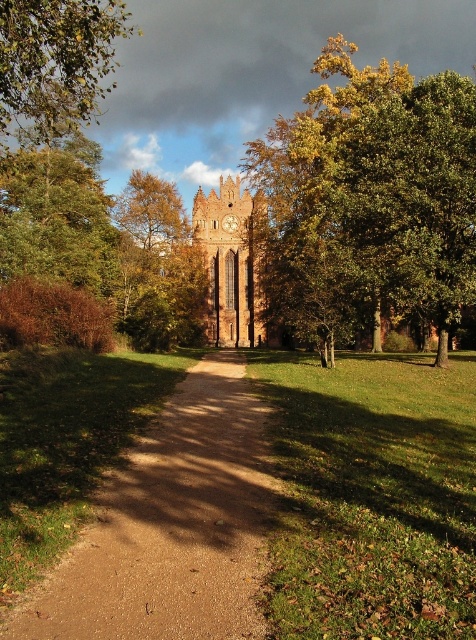
Image resolution: width=476 pixels, height=640 pixels. What do you see at coordinates (370, 196) in the screenshot?
I see `green leafy tree at upper right` at bounding box center [370, 196].

Can you confirm if green leafy tree at upper right is shorter than brown stone church at center?

Incorrect, green leafy tree at upper right's height does not fall short of brown stone church at center's.

Identify the location of green leafy tree at upper right. (370, 196).

Is point (211, 193) positioned behind point (135, 180)?

Yes, point (211, 193) is farther from viewer.

Between point (244, 221) and point (126, 212), which one is positioned in front?

Point (126, 212)

Image resolution: width=476 pixels, height=640 pixels. I want to click on brown stone church at center, so click(x=232, y=262).

Between point (134, 202) and point (228, 224), which one is positioned behind?

Point (228, 224)

Who is positioned more to the right, yellow-green leaves at upper center or wooden clock at center?

wooden clock at center is more to the right.

Who is more distant from viewer, (138, 243) or (231, 221)?

Positioned behind is point (231, 221).

The width and height of the screenshot is (476, 640). What are the coordinates of `yellow-green leaves at upper center` in the screenshot? It's located at (151, 212).